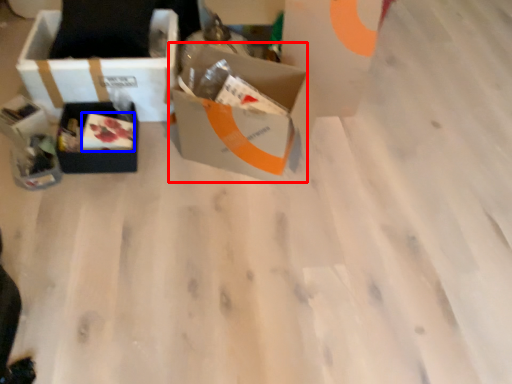
Question: Which of the following is the farthest to the observer, box (highlighted by a red box) or food (highlighted by a blue box)?

Choices:
 (A) box
 (B) food

Answer: (B)